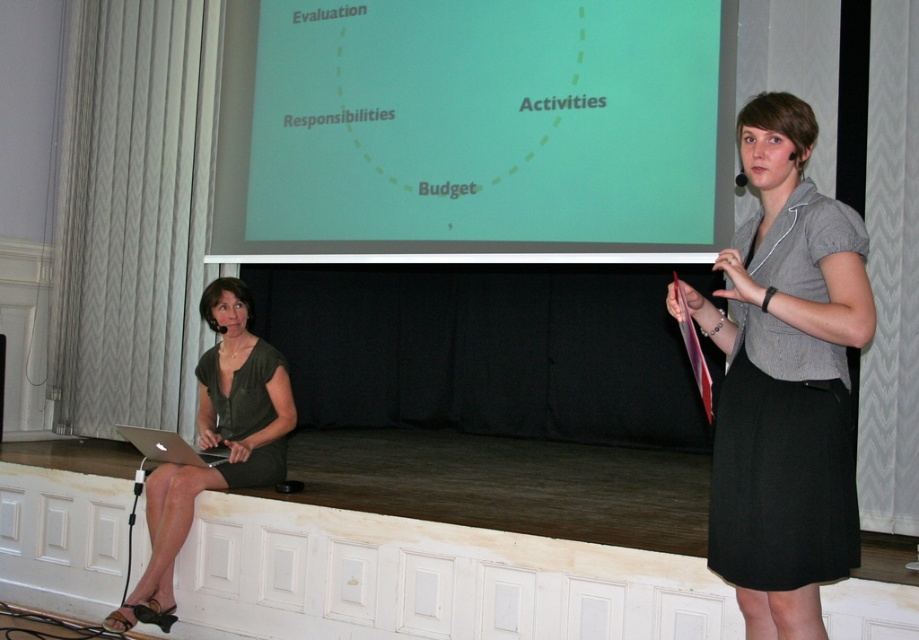
You are an event organizer who needs to place a microphone stand for the presenter. The presenter is wearing a gray fabric shirt at upper right. Where should you position the stand relative to the presenter?

The gray fabric shirt at upper right is located at point (785, 381), so the microphone stand should be positioned near that coordinate to ensure the presenter can easily access it.

You are organizing a photoshoot and need to ensure that the green matte dress at left and the matte black laptop at left can fit side by side on a display table. Given that the table is 1.2 meters wide, will both items fit if placed next to each other?

The green matte dress at left is wider than the matte black laptop at left, but their combined widths must be less than or equal to 1.2 meters to fit. However, since the exact widths are not provided, we cannot definitively determine if they will fit. Please measure both items to confirm.